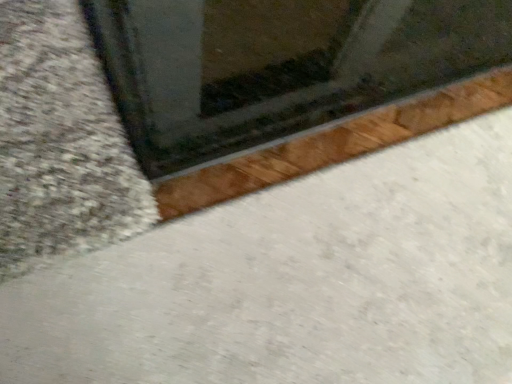
Question: Should I look upward or downward to see white smooth concrete at lower left?

Choices:
 (A) up
 (B) down

Answer: (B)

Question: From the image's perspective, is transparent glass window at upper center on white smooth concrete at lower left?

Choices:
 (A) no
 (B) yes

Answer: (B)

Question: From a real-world perspective, does transparent glass window at upper center sit lower than white smooth concrete at lower left?

Choices:
 (A) yes
 (B) no

Answer: (B)

Question: Would you say transparent glass window at upper center is a long distance from white smooth concrete at lower left?

Choices:
 (A) yes
 (B) no

Answer: (B)

Question: Can you confirm if transparent glass window at upper center is positioned to the left of white smooth concrete at lower left?

Choices:
 (A) yes
 (B) no

Answer: (B)

Question: Is transparent glass window at upper center positioned in front of white smooth concrete at lower left?

Choices:
 (A) yes
 (B) no

Answer: (B)

Question: Does transparent glass window at upper center have a lesser height compared to white smooth concrete at lower left?

Choices:
 (A) no
 (B) yes

Answer: (A)

Question: Is white smooth concrete at lower left wider than transparent glass window at upper center?

Choices:
 (A) yes
 (B) no

Answer: (A)

Question: Could you tell me if white smooth concrete at lower left is facing transparent glass window at upper center?

Choices:
 (A) no
 (B) yes

Answer: (A)

Question: Is white smooth concrete at lower left beside transparent glass window at upper center?

Choices:
 (A) no
 (B) yes

Answer: (A)

Question: Is white smooth concrete at lower left facing away from transparent glass window at upper center?

Choices:
 (A) yes
 (B) no

Answer: (B)

Question: Can you confirm if white smooth concrete at lower left is bigger than transparent glass window at upper center?

Choices:
 (A) no
 (B) yes

Answer: (A)

Question: Is white smooth concrete at lower left smaller than transparent glass window at upper center?

Choices:
 (A) no
 (B) yes

Answer: (B)

Question: Considering their positions, is white smooth concrete at lower left located in front of or behind transparent glass window at upper center?

Choices:
 (A) behind
 (B) front

Answer: (B)